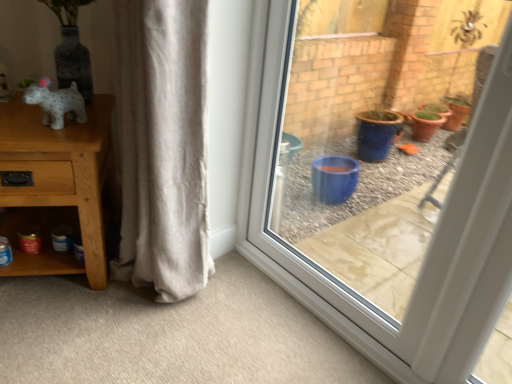
I want to click on spots to the right of beige cotton curtain at center, so click(x=226, y=296).